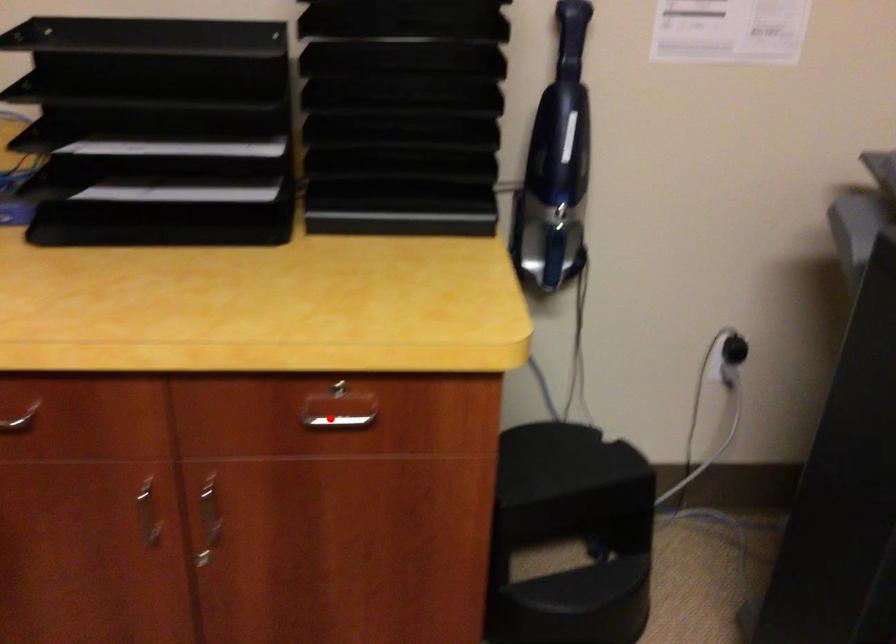
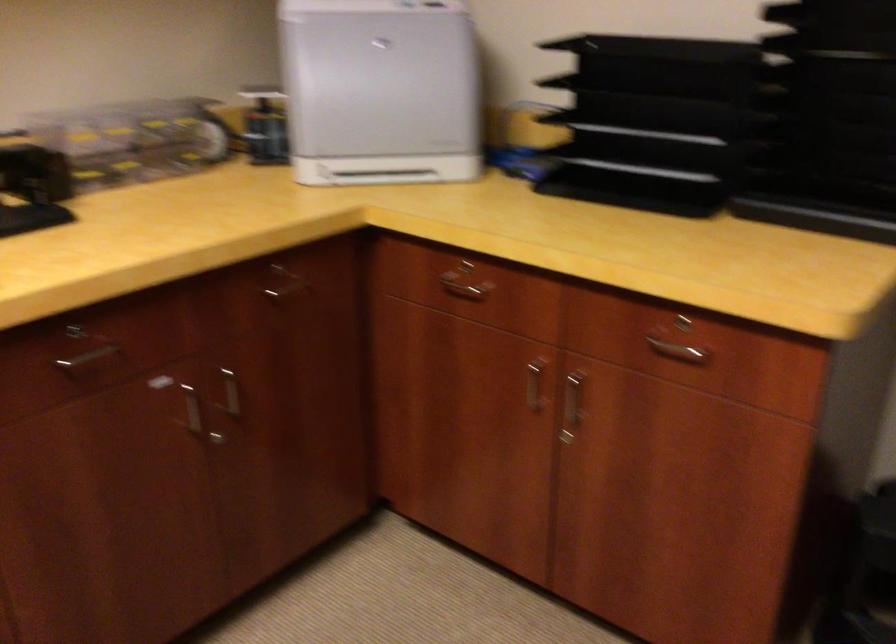
Where in the second image is the point corresponding to the highlighted location from the first image?

(677, 351)